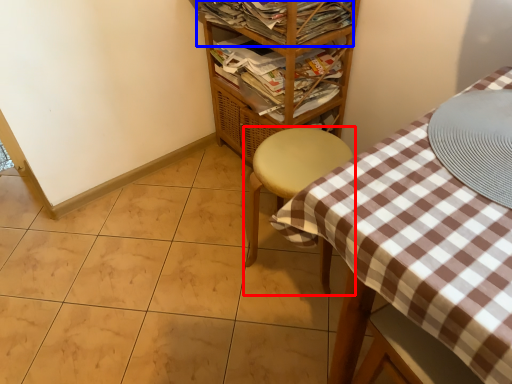
Question: Among these objects, which one is nearest to the camera, furniture (highlighted by a red box) or magazine (highlighted by a blue box)?

Choices:
 (A) furniture
 (B) magazine

Answer: (A)